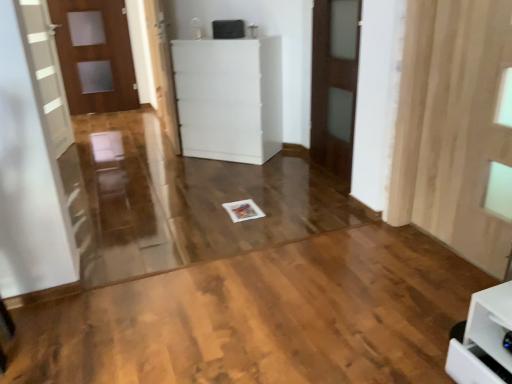
This screenshot has height=384, width=512. What are the coordinates of `vacant area to the left of brown wooden door at center, the first door viewed from the front` in the screenshot? It's located at (280, 177).